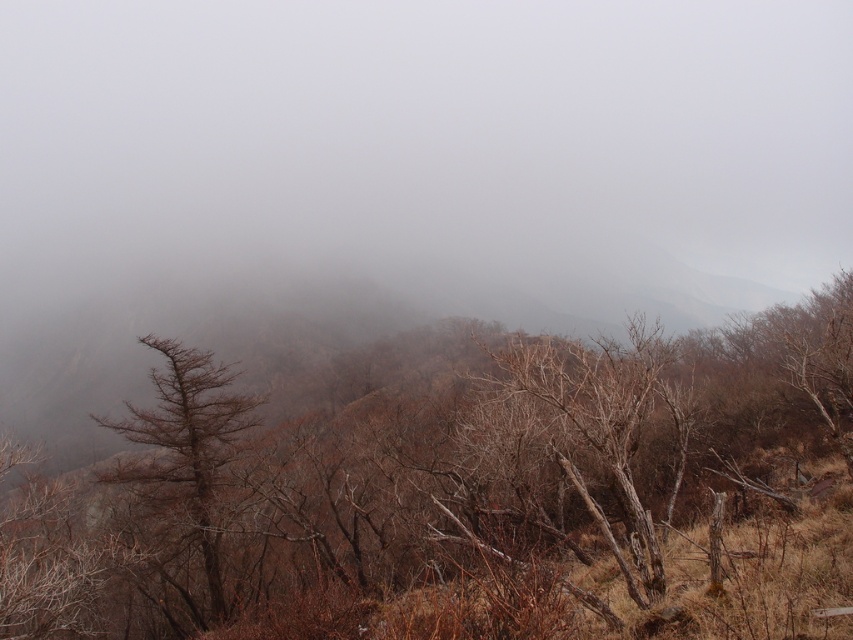
Who is higher up, brown matte tree at center or brown matte tree at left?

brown matte tree at center

In the scene shown: Is brown matte tree at center shorter than brown matte tree at left?

Incorrect, brown matte tree at center's height does not fall short of brown matte tree at left's.

What do you see at coordinates (445, 486) in the screenshot? The height and width of the screenshot is (640, 853). I see `brown matte tree at center` at bounding box center [445, 486].

You are a GUI agent. You are given a task and a screenshot of the screen. Output one action in this format:
    pyautogui.click(x=<x>, y=<y>)
    Task: Click on the brown matte tree at center
    This screenshot has width=853, height=640.
    Given the screenshot: What is the action you would take?
    pyautogui.click(x=445, y=486)